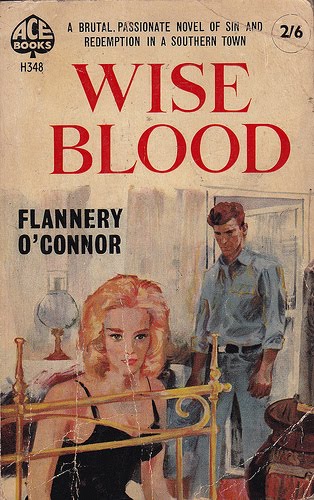
Locate an element on the screen. The height and width of the screenshot is (500, 314). books is located at coordinates (26, 47).